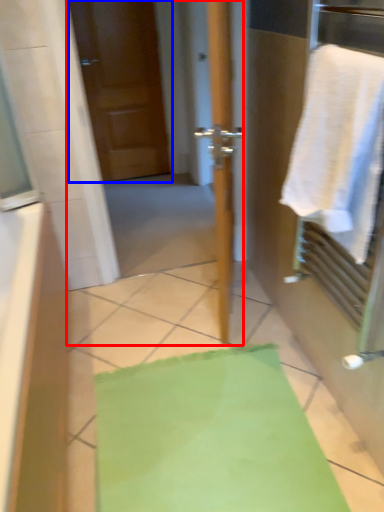
Question: Among these objects, which one is nearest to the camera, screen door (highlighted by a red box) or door (highlighted by a blue box)?

Choices:
 (A) screen door
 (B) door

Answer: (A)